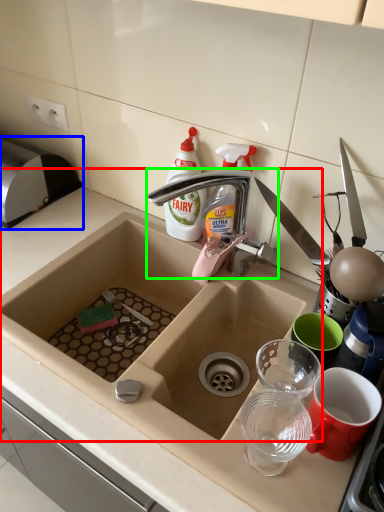
Question: Which object is the closest to the sink (highlighted by a red box)? Choose among these: appliance (highlighted by a blue box) or tap (highlighted by a green box).

Choices:
 (A) appliance
 (B) tap

Answer: (B)